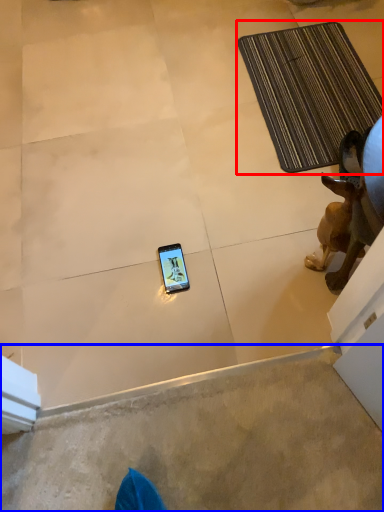
Question: Which of the following is the closest to the observer, bath mat (highlighted by a red box) or concrete (highlighted by a blue box)?

Choices:
 (A) bath mat
 (B) concrete

Answer: (B)